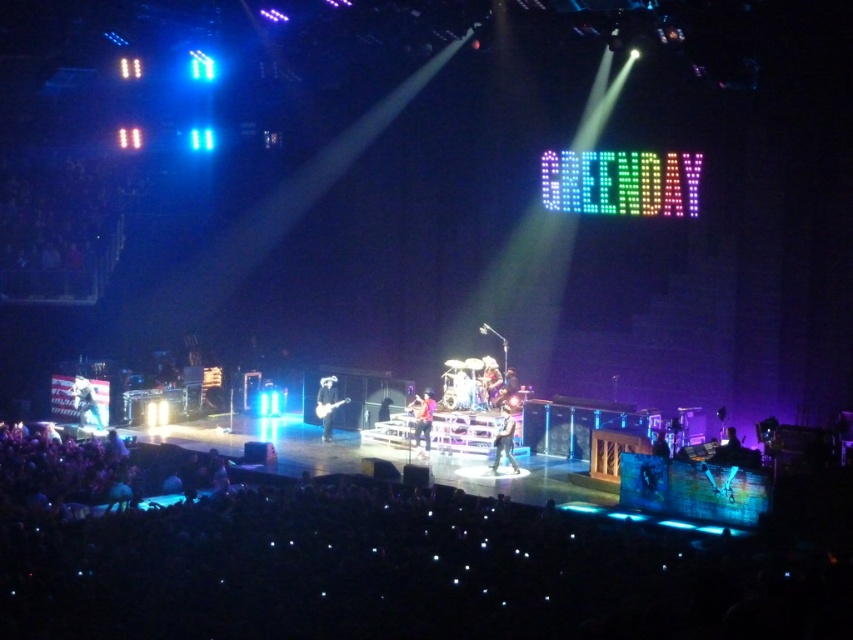
Based on the photo, is black fabric crowd at lower center to the left of reddish-brown leather guitar at center from the viewer's perspective?

Indeed, black fabric crowd at lower center is positioned on the left side of reddish-brown leather guitar at center.

Who is positioned more to the right, black fabric crowd at lower center or reddish-brown leather guitar at center?

reddish-brown leather guitar at center is more to the right.

Does point (229, 524) lie behind point (425, 422)?

That is False.

The height and width of the screenshot is (640, 853). I want to click on black fabric crowd at lower center, so coord(392,564).

Is black fabric crowd at lower center behind denim jacket at center?

No, it is in front of denim jacket at center.

Does black fabric crowd at lower center appear under denim jacket at center?

Yes.

Is point (258, 580) farther from viewer compared to point (509, 456)?

No, (258, 580) is closer to viewer.

Where is `black fabric crowd at lower center`? The height and width of the screenshot is (640, 853). black fabric crowd at lower center is located at coordinates (392, 564).

Is matte black guitar at center positioned in front of reddish-brown leather guitar at center?

No, it is behind reddish-brown leather guitar at center.

Does matte black guitar at center appear on the right side of reddish-brown leather guitar at center?

In fact, matte black guitar at center is to the left of reddish-brown leather guitar at center.

Is point (326, 433) behind point (427, 444)?

Yes, it is behind point (427, 444).

Identify the location of matte black guitar at center. (326, 404).